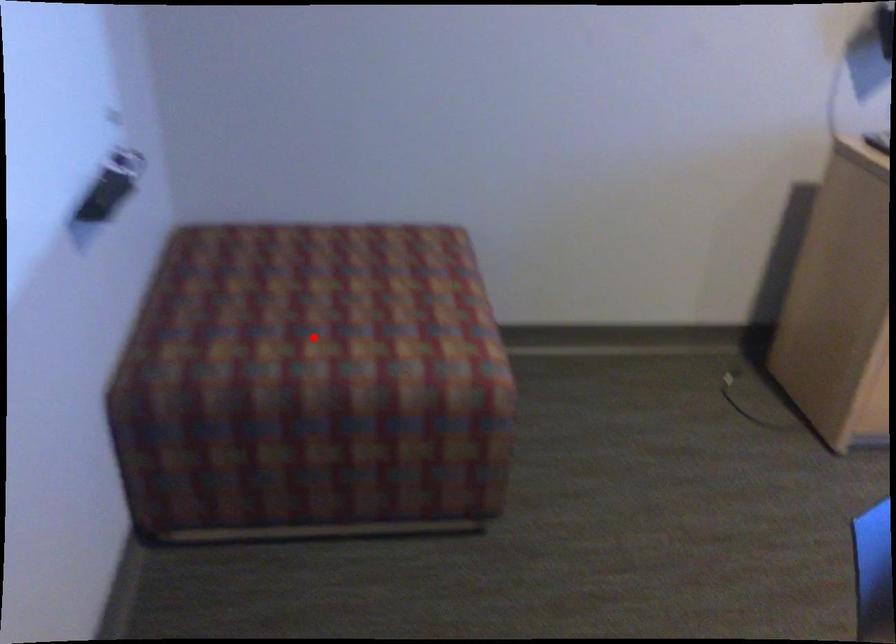
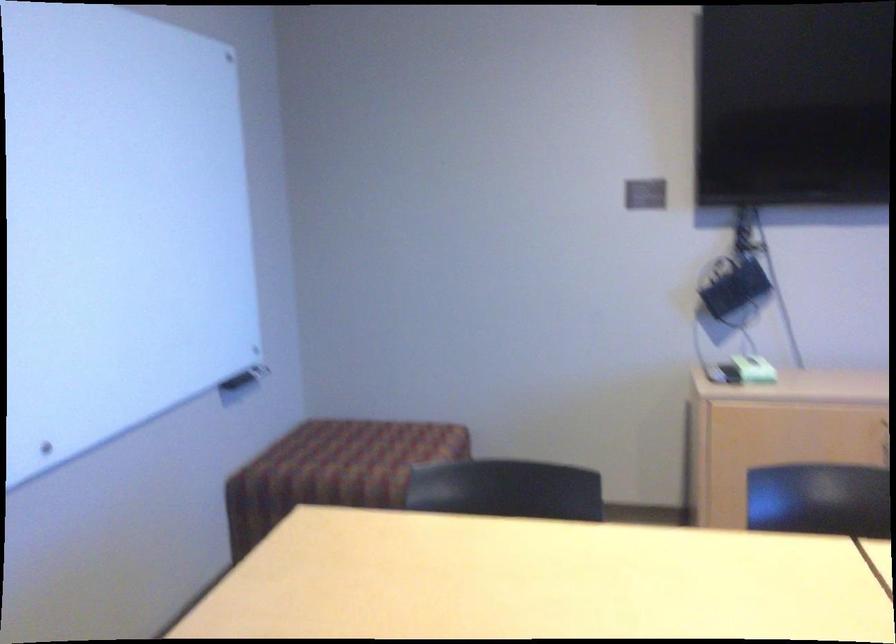
Question: I am providing you with two images of the same scene from different viewpoints. Image1 has a red point marked. In image2, the corresponding 3D location appears at what relative position? Reply with the corresponding letter.

Choices:
 (A) Closer
 (B) Farther

Answer: (B)